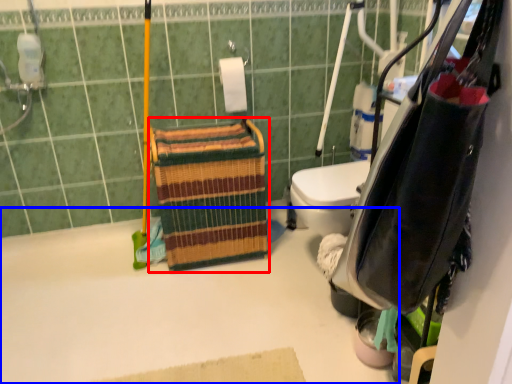
Question: Which object is further to the camera taking this photo, basket (highlighted by a red box) or bath (highlighted by a blue box)?

Choices:
 (A) basket
 (B) bath

Answer: (A)